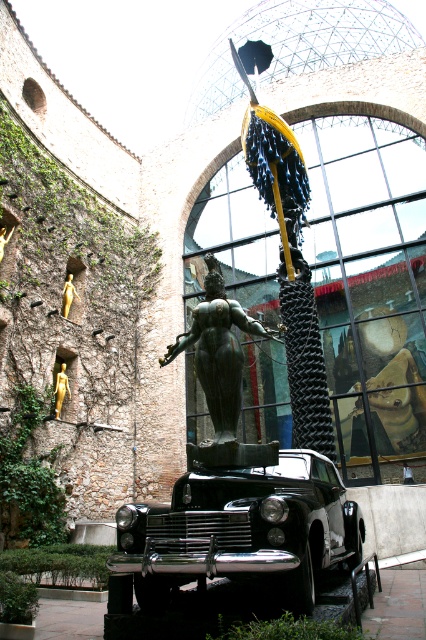
Question: Estimate the real-world distances between objects in this image. Which object is closer to the gold metallic statue at left?

Choices:
 (A) bronze statue at center
 (B) shiny black car at center

Answer: (A)

Question: Can you confirm if shiny black car at center is positioned above gold metallic statue at upper left?

Choices:
 (A) no
 (B) yes

Answer: (A)

Question: Can you confirm if shiny black car at center is bigger than bronze statue at center?

Choices:
 (A) no
 (B) yes

Answer: (B)

Question: Considering the relative positions of bronze statue at center and gold metallic statue at upper left in the image provided, where is bronze statue at center located with respect to gold metallic statue at upper left?

Choices:
 (A) right
 (B) left

Answer: (A)

Question: Which point is closer to the camera?

Choices:
 (A) shiny black car at center
 (B) gold metallic statue at upper left
 (C) bronze statue at center

Answer: (A)

Question: Estimate the real-world distances between objects in this image. Which object is farther from the bronze statue at center?

Choices:
 (A) gold metallic statue at upper left
 (B) shiny black car at center
 (C) gold metallic statue at left

Answer: (A)